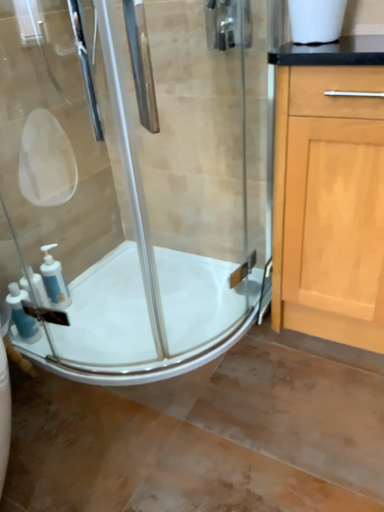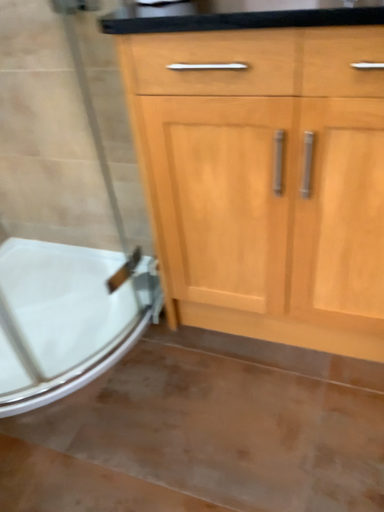
Question: How did the camera likely rotate when shooting the video?

Choices:
 (A) rotated left
 (B) rotated right

Answer: (B)